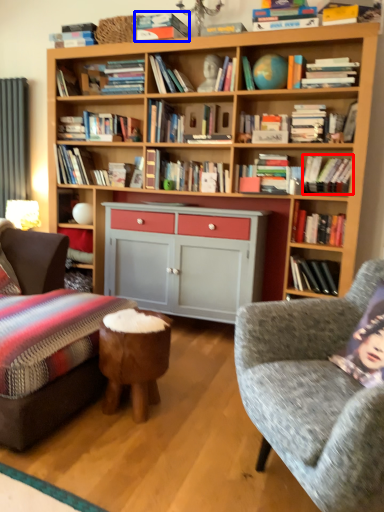
Question: Which point is further to the camera, book (highlighted by a red box) or book (highlighted by a blue box)?

Choices:
 (A) book
 (B) book

Answer: (B)